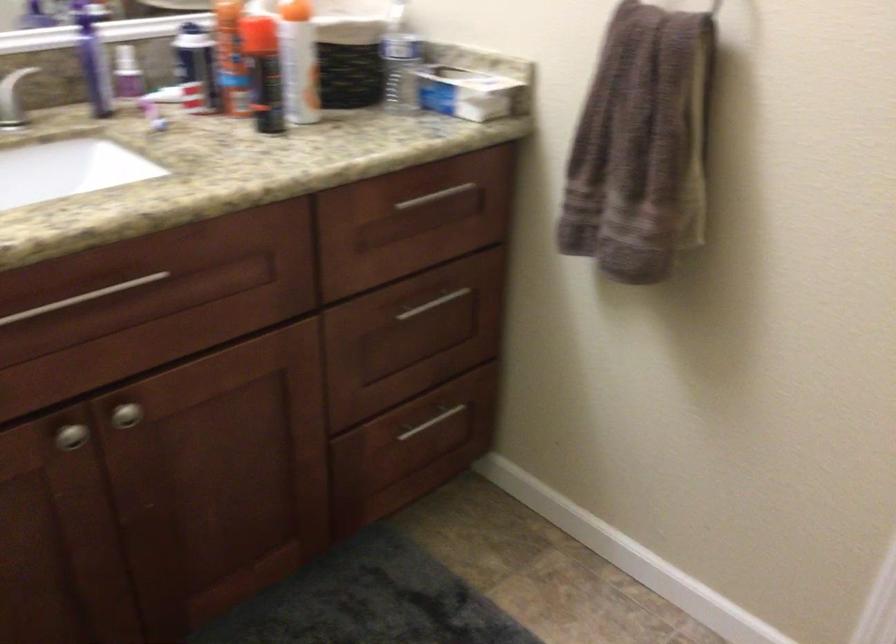
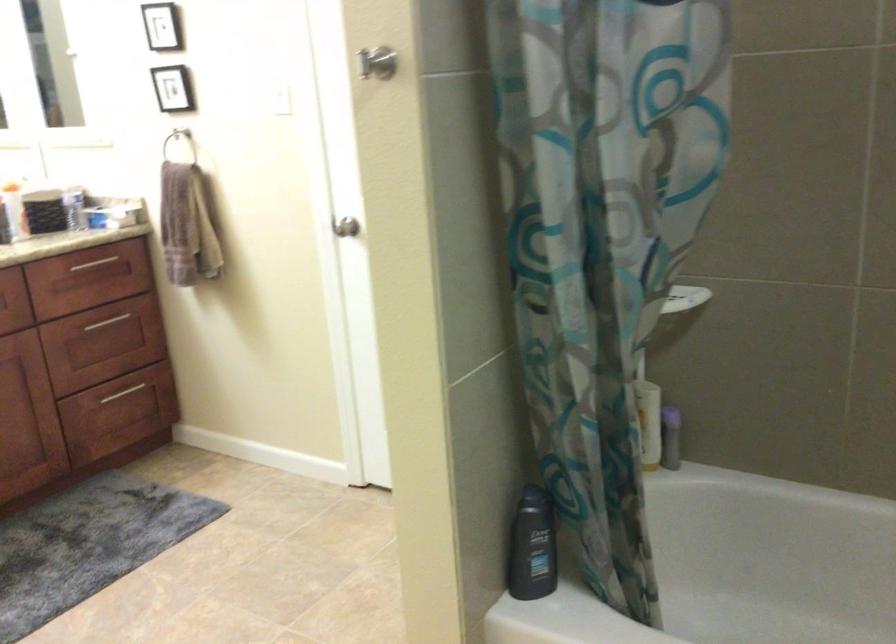
In the second image, find the point that corresponds to (x=417, y=205) in the first image.

(92, 263)